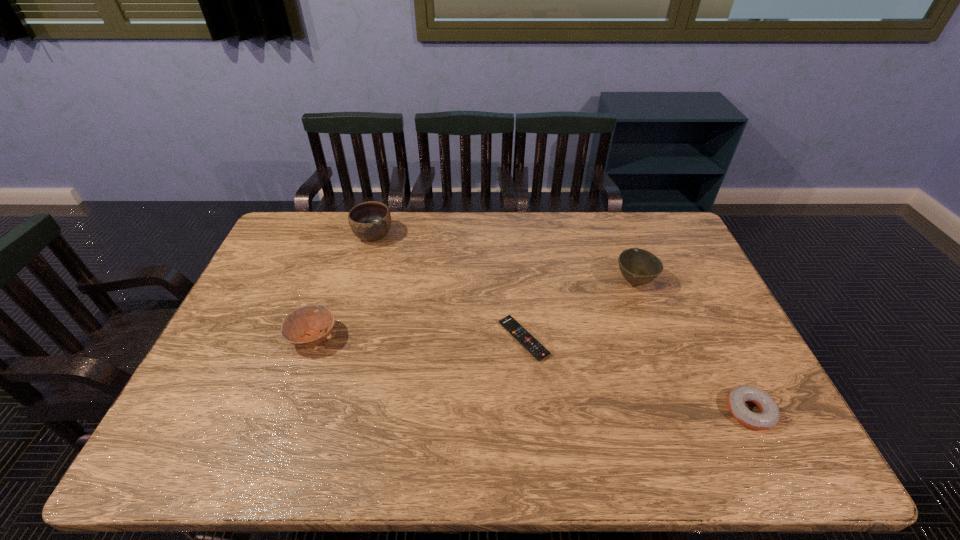
Identify the location of vacant space located on the front of the rightmost bowl. Image resolution: width=960 pixels, height=540 pixels. (648, 318).

This screenshot has width=960, height=540. I want to click on blank area located 0.070m on the right of the third tallest object, so click(363, 338).

Find the location of a particular element. This screenshot has width=960, height=540. vacant area situated on the front of the fourth tallest object is located at coordinates (778, 468).

Identify the location of free spot located on the back of the third object from right to left. (517, 274).

Locate an element on the screen. object that is at the far edge is located at coordinates (370, 221).

Find the location of a particular element. This screenshot has width=960, height=540. object located at the near edge is located at coordinates [x=769, y=416].

Where is `bowl that is positioned at the right edge`? Image resolution: width=960 pixels, height=540 pixels. bowl that is positioned at the right edge is located at coordinates (638, 266).

What are the coordinates of `doughnut that is at the right edge` in the screenshot? It's located at (769, 416).

Locate an element on the screen. This screenshot has width=960, height=540. object situated at the near right corner is located at coordinates (769, 416).

You are a GUI agent. You are given a task and a screenshot of the screen. Output one action in this format:
    pyautogui.click(x=<x>, y=<y>)
    Task: Click on the free region at the far edge of the desktop
    This screenshot has height=540, width=960.
    Given the screenshot: What is the action you would take?
    pyautogui.click(x=488, y=225)